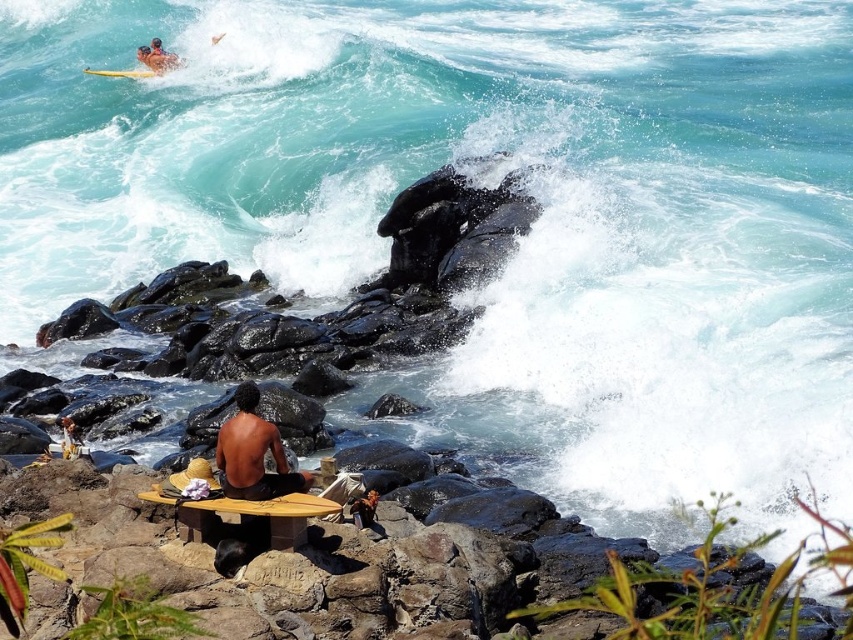
Question: Does wooden surfboard at lower center have a smaller size compared to yellow foam surfboard at upper left?

Choices:
 (A) no
 (B) yes

Answer: (B)

Question: Which point is closer to the camera?

Choices:
 (A) (250, 451)
 (B) (280, 516)
 (C) (126, 74)

Answer: (B)

Question: Does shiny black skin at center have a lesser width compared to yellow foam surfboard at upper left?

Choices:
 (A) yes
 (B) no

Answer: (A)

Question: Where is shiny black skin at center located in relation to yellow foam surfboard at upper left in the image?

Choices:
 (A) below
 (B) above

Answer: (A)

Question: Which point is farther from the camera taking this photo?

Choices:
 (A) (223, 502)
 (B) (288, 468)
 (C) (154, 72)

Answer: (C)

Question: Considering the real-world distances, which object is farthest from the wooden surfboard at lower center?

Choices:
 (A) yellow foam surfboard at upper left
 (B) shiny black skin at center

Answer: (A)